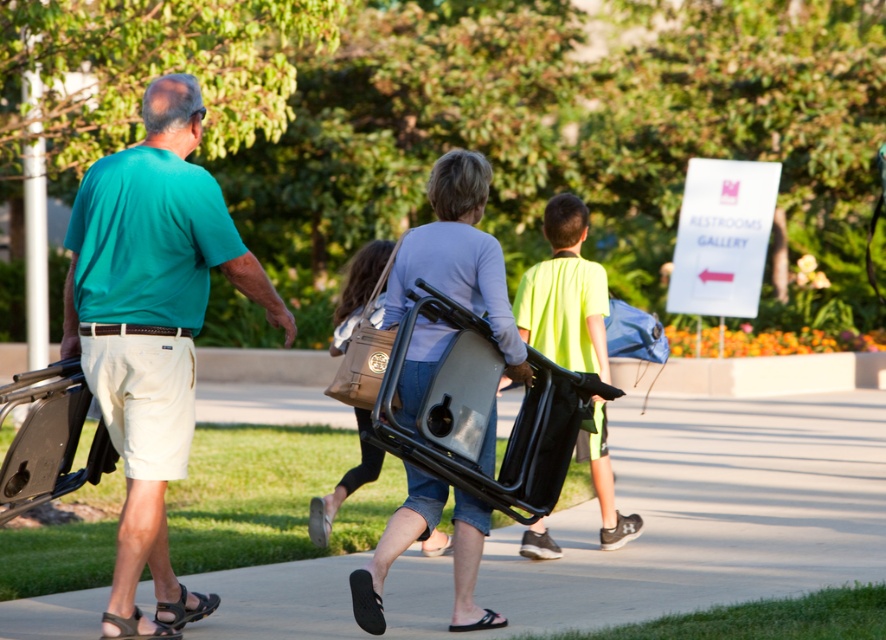
You are a photographer trying to capture a group photo of the teal matte shirt at left and the neon yellow shirt at center. If you want to ensure both subjects are in focus, which one should you adjust your camera focus on first?

The teal matte shirt at left is wider than the neon yellow shirt at center, so you should focus on the teal matte shirt at left first to ensure both are in focus.